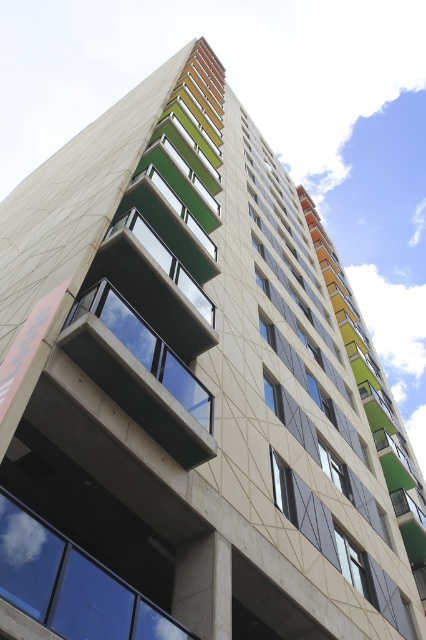
Based on the photo, you are an architect evaluating the building facade. You notice two windows at the center of the building labeled as transparent glass window at center and clear glass window at center. Which one has a greater width?

The transparent glass window at center has a greater width than the clear glass window at center according to the description.

You are standing in front of the modern multi story building with colorful balconies. You notice two points marked on the building facade. The first point is at coordinate point [135,346] and the second point is at coordinate point [362,573]. Which point is closer to you?

Point [135,346] is in front of point [362,573], so it is closer to you.